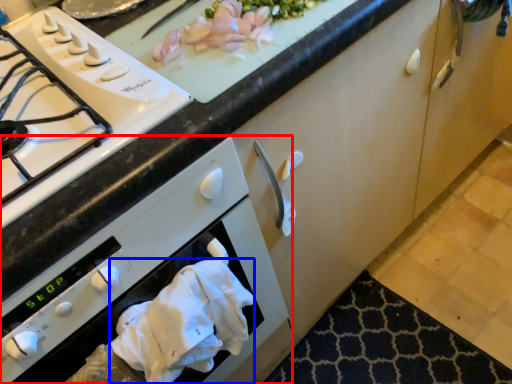
Question: Which object is further to the camera taking this photo, oven (highlighted by a red box) or hand towel (highlighted by a blue box)?

Choices:
 (A) oven
 (B) hand towel

Answer: (B)